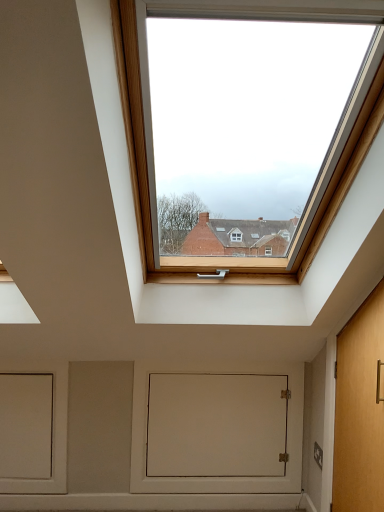
Question: Would you say light brown wooden door at right is to the left or to the right of white matte door at center in the picture?

Choices:
 (A) left
 (B) right

Answer: (B)

Question: From their relative heights in the image, would you say light brown wooden door at right is taller or shorter than white matte door at center?

Choices:
 (A) short
 (B) tall

Answer: (B)

Question: Relative to white matte door at center, is light brown wooden door at right in front or behind?

Choices:
 (A) front
 (B) behind

Answer: (A)

Question: Is white matte door at center spatially inside light brown wooden door at right, or outside of it?

Choices:
 (A) outside
 (B) inside

Answer: (A)

Question: In terms of width, does white matte door at center look wider or thinner when compared to light brown wooden door at right?

Choices:
 (A) thin
 (B) wide

Answer: (A)

Question: Relative to light brown wooden door at right, is white matte door at center in front or behind?

Choices:
 (A) behind
 (B) front

Answer: (A)

Question: From a real-world perspective, is white matte door at center physically located above or below light brown wooden door at right?

Choices:
 (A) above
 (B) below

Answer: (B)